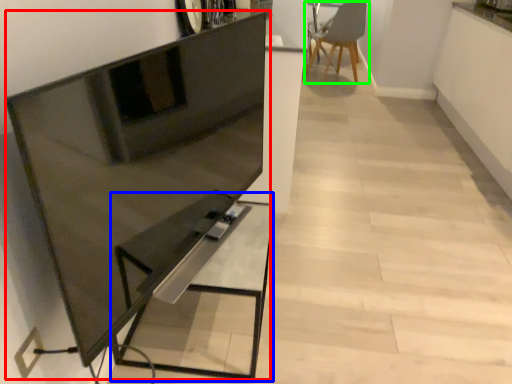
Question: Which object is the farthest from entertainment center (highlighted by a red box)? Choose among these: table (highlighted by a blue box) or chair (highlighted by a green box).

Choices:
 (A) table
 (B) chair

Answer: (B)